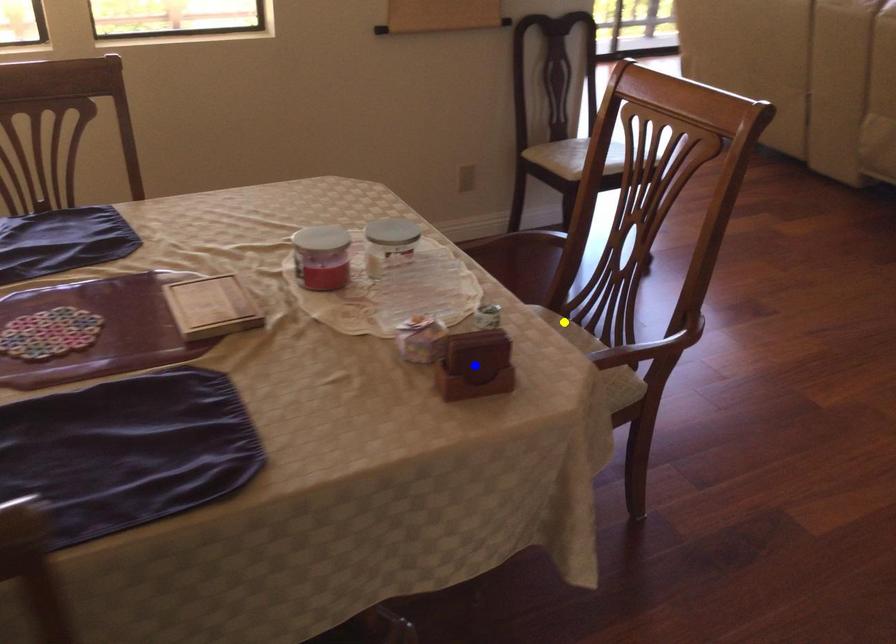
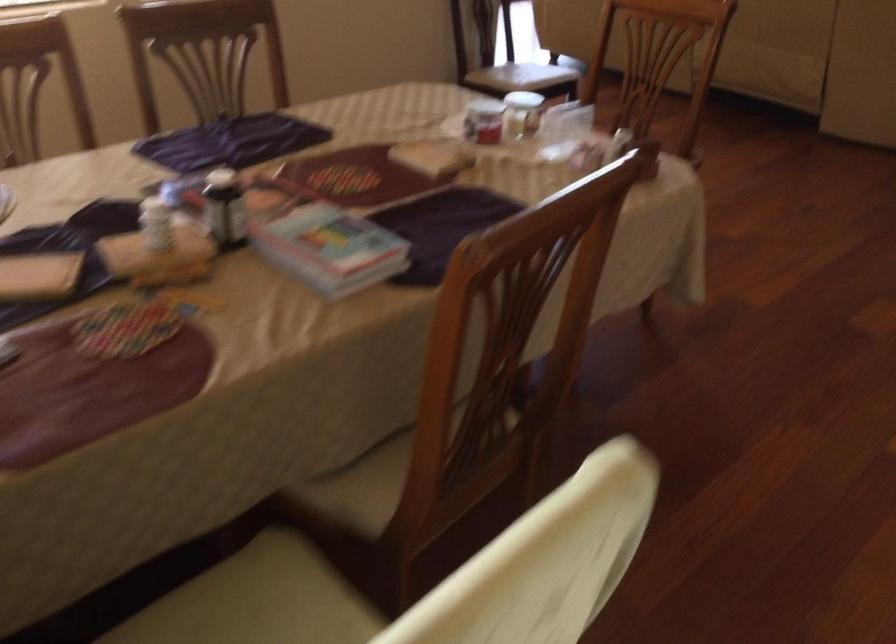
I am providing you with two images of the same scene from different viewpoints. Three points are marked in image1. Which point corresponds to a part or object that is occluded in image2?In image1, three points are marked. Which of them correspond to a part or object that is occluded in image2?Among the three points shown in image1, which one corresponds to a part or object that is no longer visible due to occlusion in image2?

green point, blue point, yellow point cannot be seen in image2.